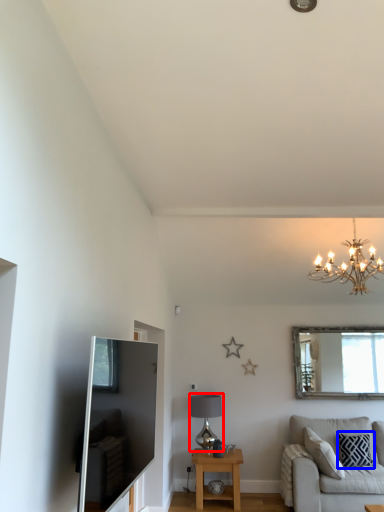
Question: Which object is further to the camera taking this photo, lamp (highlighted by a red box) or pillow (highlighted by a blue box)?

Choices:
 (A) lamp
 (B) pillow

Answer: (A)